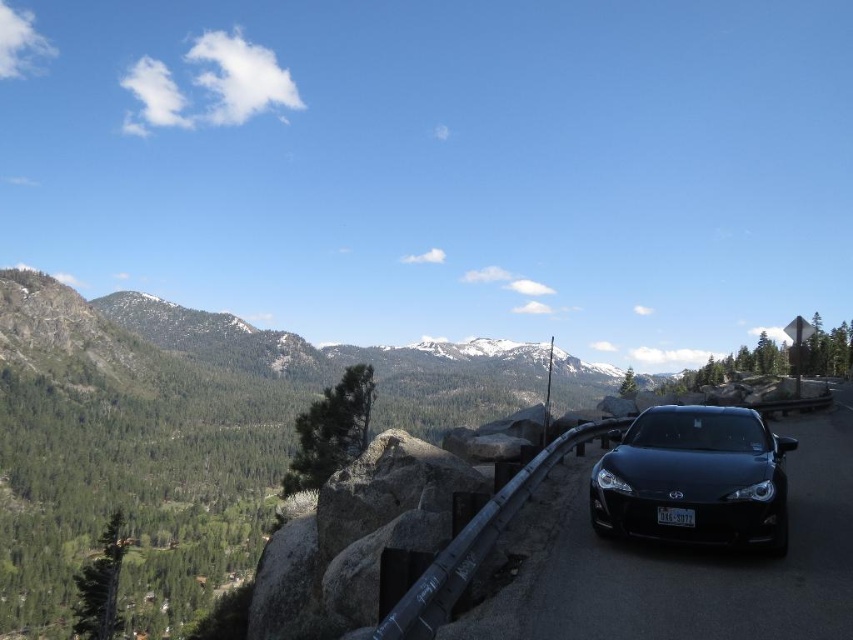
Which is below, glossy black car at center or white plastic license plate at center?

glossy black car at center

Describe the element at coordinates (715, 563) in the screenshot. I see `glossy black car at center` at that location.

Who is more forward, (698, 602) or (688, 525)?

Point (698, 602) is in front.

The width and height of the screenshot is (853, 640). I want to click on glossy black car at center, so click(x=715, y=563).

Who is positioned more to the right, matte black car at center or white plastic license plate at center?

From the viewer's perspective, matte black car at center appears more on the right side.

Which is behind, point (735, 461) or point (665, 524)?

The point (735, 461) is more distant.

Image resolution: width=853 pixels, height=640 pixels. In order to click on matte black car at center in this screenshot , I will do `click(695, 477)`.

Can you confirm if glossy black car at center is positioned to the left of matte black car at center?

Yes, glossy black car at center is to the left of matte black car at center.

Is glossy black car at center shorter than matte black car at center?

Indeed, glossy black car at center has a lesser height compared to matte black car at center.

Between point (837, 547) and point (746, 470), which one is positioned behind?

Positioned behind is point (746, 470).

This screenshot has width=853, height=640. What are the coordinates of `glossy black car at center` in the screenshot? It's located at (715, 563).